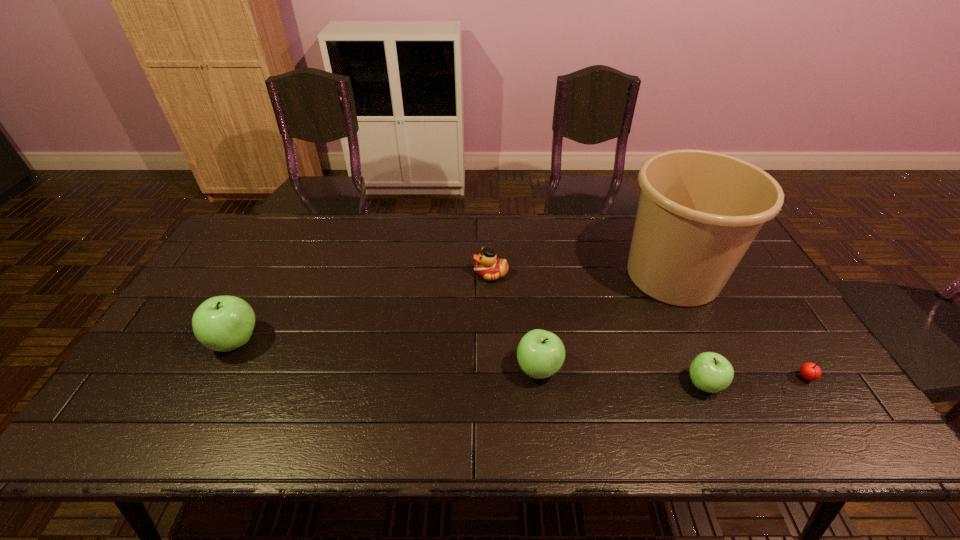
The height and width of the screenshot is (540, 960). I want to click on cherry that is at the right edge, so click(x=810, y=371).

The height and width of the screenshot is (540, 960). What are the coordinates of `object located in the far right corner section of the desktop` in the screenshot? It's located at (699, 211).

Where is `object at the near right corner`? This screenshot has width=960, height=540. object at the near right corner is located at coordinates (810, 371).

Where is `free space at the far edge of the desktop`? This screenshot has height=540, width=960. free space at the far edge of the desktop is located at coordinates (560, 238).

I want to click on vacant space at the near edge, so click(x=637, y=382).

This screenshot has width=960, height=540. I want to click on vacant area at the left edge, so click(246, 262).

In the image, there is a desktop. In order to click on free space at the near right corner in this screenshot , I will do `click(824, 377)`.

This screenshot has width=960, height=540. Find the location of `unoccupied area between the rightmost apple and the duck`. unoccupied area between the rightmost apple and the duck is located at coordinates (597, 329).

Locate an element on the screen. vacant area between the fifth object from right to left and the shortest apple is located at coordinates (597, 329).

The width and height of the screenshot is (960, 540). What are the coordinates of `empty space between the duck and the rightmost object` in the screenshot? It's located at (649, 326).